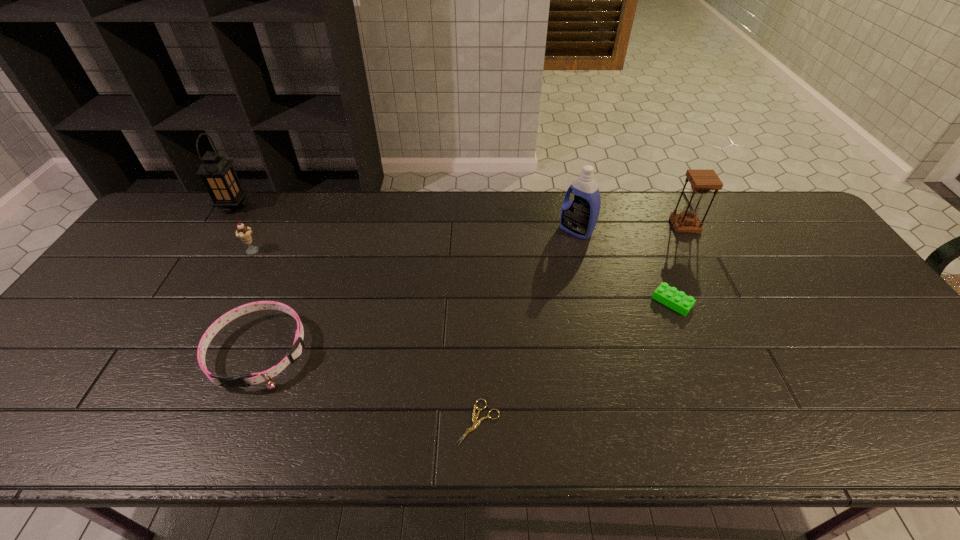
At what (x,y) coordinates should I click in order to perform the action: click on detergent present at the far edge. Please return your answer as a coordinate pair (x, y). This screenshot has height=540, width=960. Looking at the image, I should click on pyautogui.click(x=578, y=217).

Where is `hourglass that is at the far edge`? Image resolution: width=960 pixels, height=540 pixels. hourglass that is at the far edge is located at coordinates (702, 181).

The width and height of the screenshot is (960, 540). I want to click on object located at the near edge, so click(x=476, y=422).

Image resolution: width=960 pixels, height=540 pixels. In the image, there is a desktop. What are the coordinates of `vacant area at the far edge` in the screenshot? It's located at (521, 228).

Where is `vacant space at the near edge`? This screenshot has width=960, height=540. vacant space at the near edge is located at coordinates (622, 426).

Locate an element on the screen. The image size is (960, 540). vacant space at the left edge is located at coordinates (127, 304).

Where is `free space at the near left corner of the desktop`? Image resolution: width=960 pixels, height=540 pixels. free space at the near left corner of the desktop is located at coordinates (55, 433).

Image resolution: width=960 pixels, height=540 pixels. In the image, there is a desktop. What are the coordinates of `vacant space at the far right corner` in the screenshot? It's located at (735, 194).

Identify the location of vacant area between the detergent and the Lego. Image resolution: width=960 pixels, height=540 pixels. (624, 266).

Find the location of a particular element. vacant space that is in between the shears and the detergent is located at coordinates (527, 326).